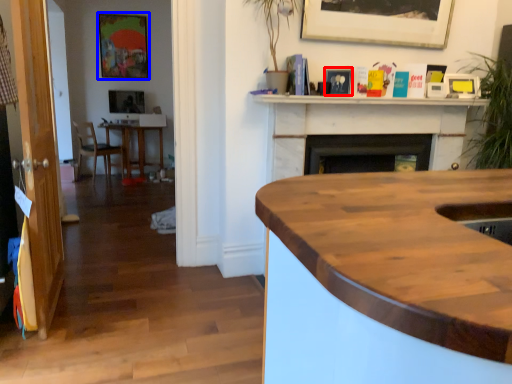
Question: Which object appears farthest to the camera in this image, picture frame (highlighted by a red box) or picture frame (highlighted by a blue box)?

Choices:
 (A) picture frame
 (B) picture frame

Answer: (B)